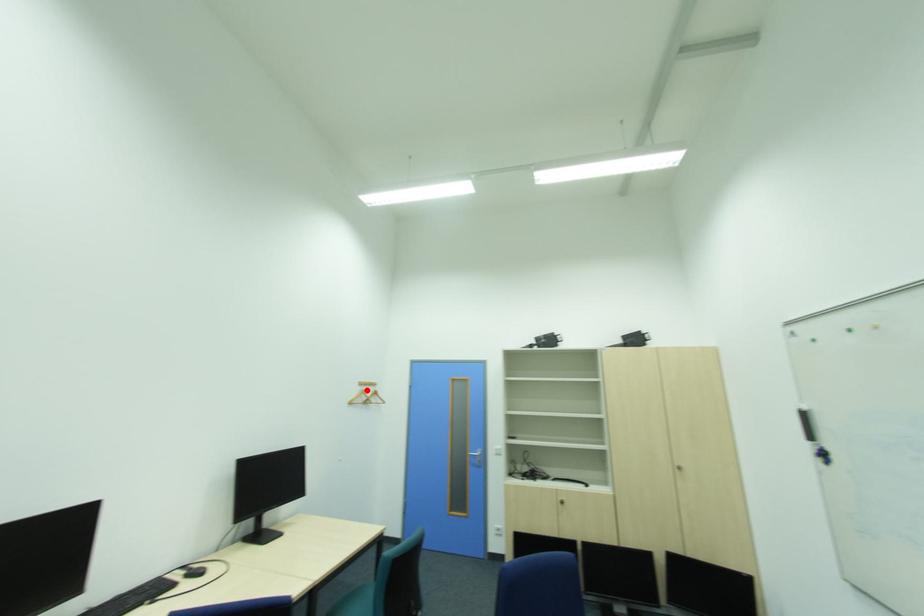
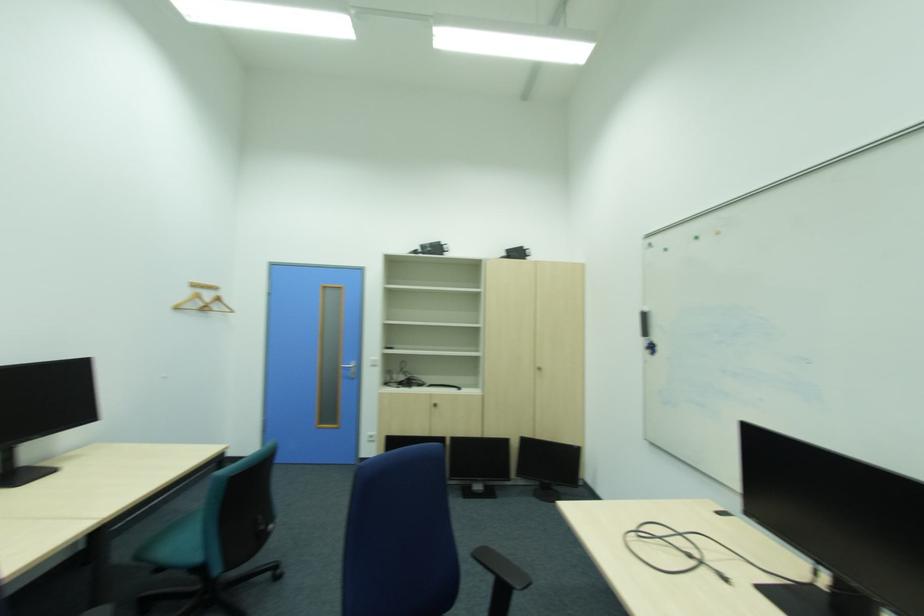
Question: I am providing you with two images of the same scene from different viewpoints. A red point is marked on the first image. At the location where the point appears in image 1, is it still visible in image 2?

Choices:
 (A) Yes
 (B) No

Answer: (A)